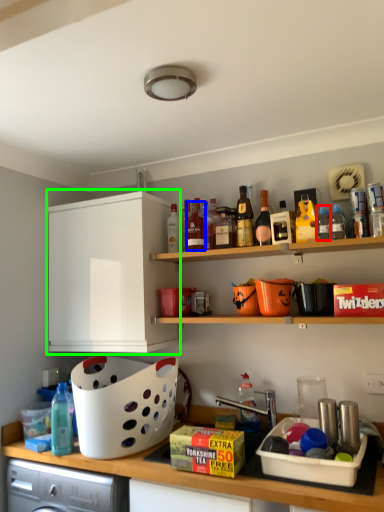
Question: Which is nearer to the bottle (highlighted by a red box)? bottle (highlighted by a blue box) or cabinetry (highlighted by a green box).

Choices:
 (A) bottle
 (B) cabinetry

Answer: (A)